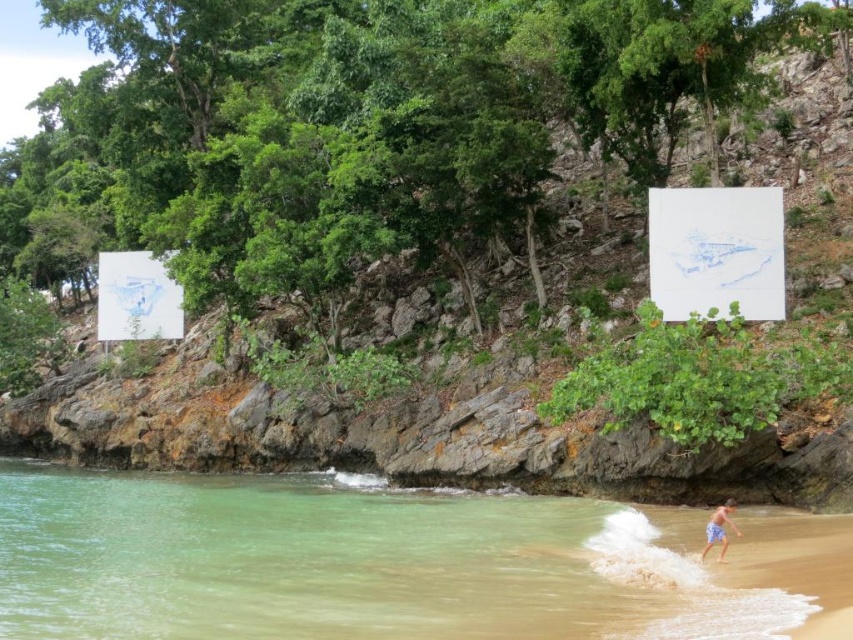
You are a lifeguard observing the beach scene. You notice the clear water at beach right and the blue striped shorts at lower right. Which object is located to the left of the other?

The clear water at beach right is positioned on the left side of blue striped shorts at lower right.